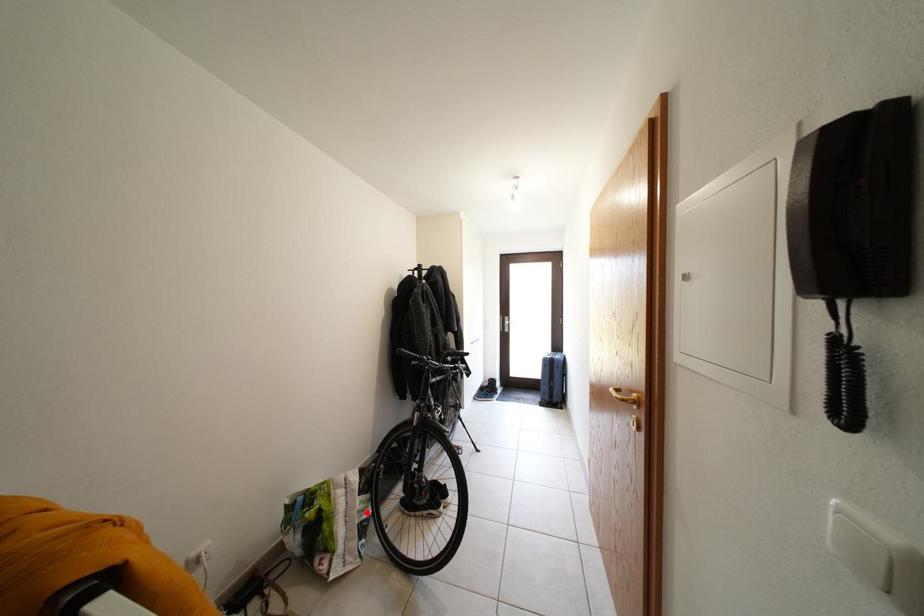
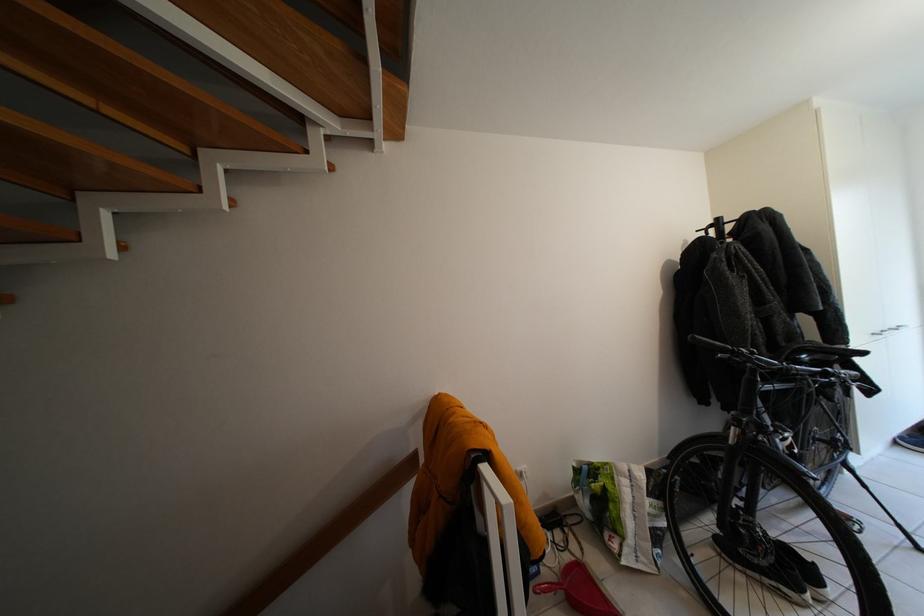
Find the pixel in the second image that matches the highlighted location in the first image.

(657, 515)